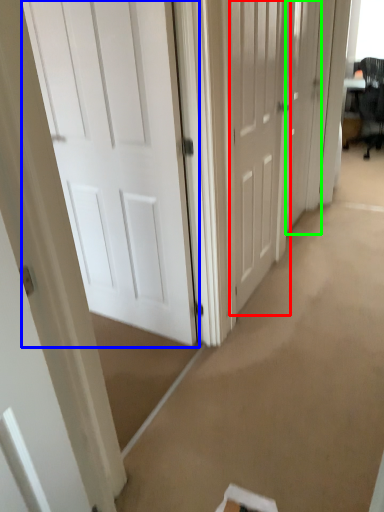
Question: Considering the real-world distances, which object is closest to door (highlighted by a red box)? door (highlighted by a blue box) or door (highlighted by a green box).

Choices:
 (A) door
 (B) door

Answer: (B)